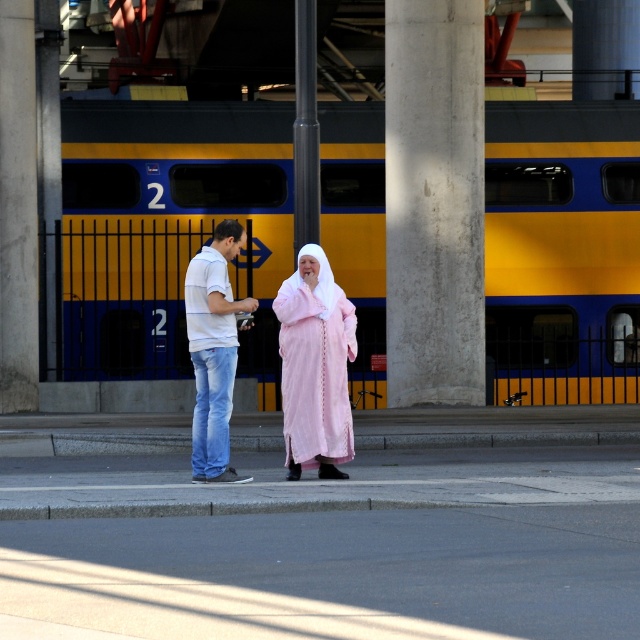
Question: Which point is farther to the camera?

Choices:
 (A) (332, 433)
 (B) (212, 397)
 (C) (211, 440)
 (D) (182, 253)

Answer: (D)

Question: Which point appears farthest from the camera in this image?

Choices:
 (A) (328, 374)
 (B) (124, 332)

Answer: (B)

Question: Among these objects, which one is farthest from the camera?

Choices:
 (A) white cotton shirt at left
 (B) yellowmetallictrain at center
 (C) pink satin dress at center
 (D) matte pink robe at center

Answer: (B)

Question: Can you confirm if matte pink robe at center is positioned to the right of pink satin dress at center?

Choices:
 (A) yes
 (B) no

Answer: (A)

Question: Does yellowmetallictrain at center have a larger size compared to matte pink robe at center?

Choices:
 (A) yes
 (B) no

Answer: (A)

Question: Is yellowmetallictrain at center bigger than white cotton shirt at left?

Choices:
 (A) no
 (B) yes

Answer: (B)